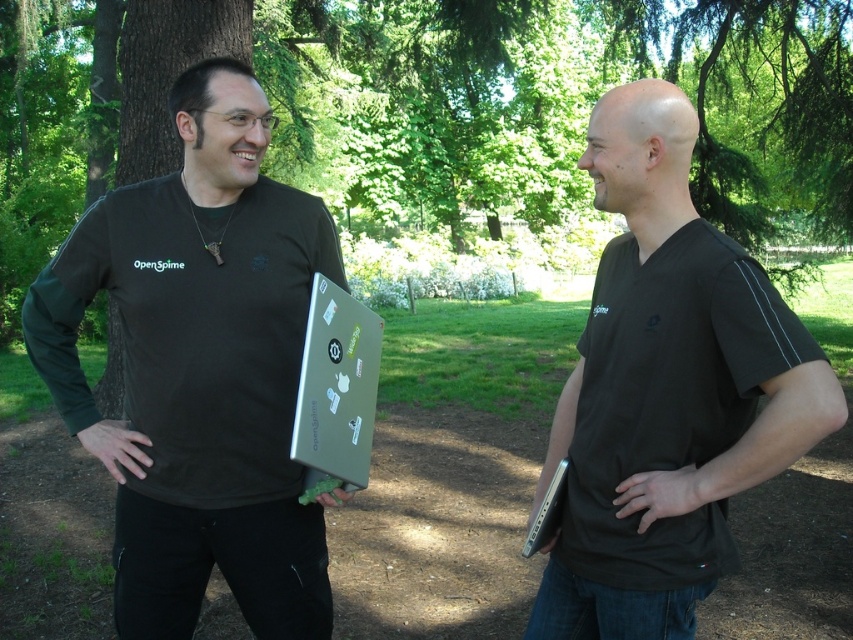
Between matte black laptop at center and silver metallic laptop at center, which one has more height?

Standing taller between the two is matte black laptop at center.

Can you confirm if matte black laptop at center is thinner than silver metallic laptop at center?

In fact, matte black laptop at center might be wider than silver metallic laptop at center.

What do you see at coordinates (200, 369) in the screenshot? I see `matte black laptop at center` at bounding box center [200, 369].

At what (x,y) coordinates should I click in order to perform the action: click on matte black laptop at center. Please return your answer as a coordinate pair (x, y). The width and height of the screenshot is (853, 640). Looking at the image, I should click on point(200,369).

Who is positioned more to the right, green leafy tree at center or matte black laptop at center?

matte black laptop at center

Who is more distant from viewer, [618,64] or [56,380]?

Positioned behind is point [618,64].

Find the location of `green leafy tree at center`. green leafy tree at center is located at coordinates (442, 106).

Can you confirm if black matte shirt at center is positioned to the right of silver metallic laptop at center?

Indeed, black matte shirt at center is positioned on the right side of silver metallic laptop at center.

Does black matte shirt at center have a greater height compared to silver metallic laptop at center?

Yes.

Identify the location of black matte shirt at center. (666, 392).